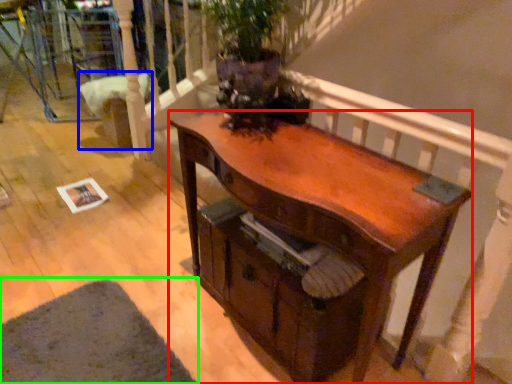
Question: Considering the real-world distances, which object is closest to desk (highlighted by a red box)? armchair (highlighted by a blue box) or mat (highlighted by a green box).

Choices:
 (A) armchair
 (B) mat

Answer: (B)